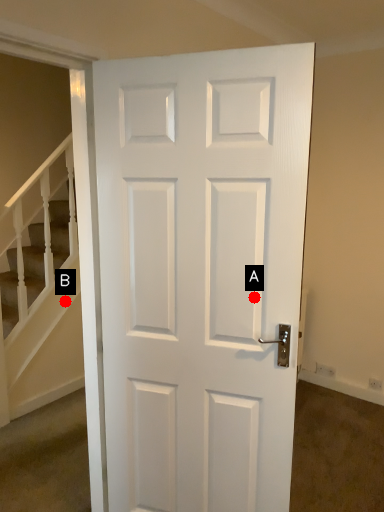
Question: Two points are circled on the image, labeled by A and B beside each circle. Which point is farther from the camera taking this photo?

Choices:
 (A) A is further
 (B) B is further

Answer: (B)